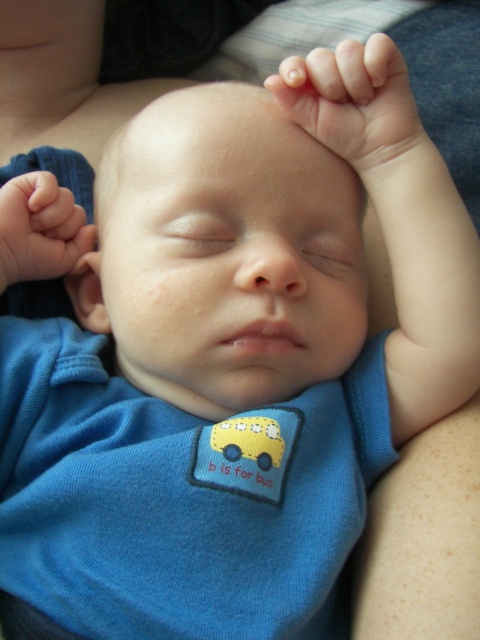
You are a photographer taking a close up of a sleeping baby. You notice the smooth skin head at center and the smooth skin hand at upper center in your viewfinder. Which object is closer to your camera lens?

The smooth skin head at center is closer to the viewer than the smooth skin hand at upper center, so the smooth skin head at center would be closer to the camera lens.